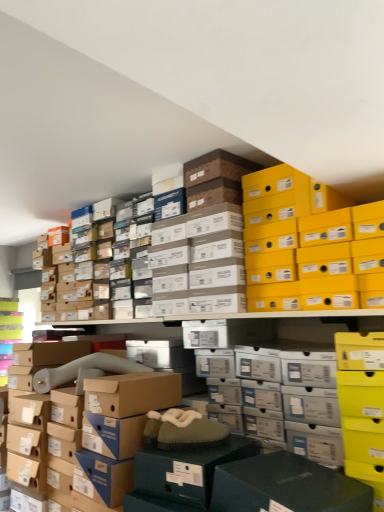
The image size is (384, 512). What do you see at coordinates (307, 251) in the screenshot? I see `yellow matte shoebox at upper right, which ranks as the second storage box in bottom-to-top order` at bounding box center [307, 251].

How much space does yellow matte shoebox at upper right, the first storage box in the right-to-left sequence, occupy horizontally?

yellow matte shoebox at upper right, the first storage box in the right-to-left sequence, is 12.72 inches in width.

At what (x,y) coordinates should I click in order to perform the action: click on yellow matte shoebox at upper right, the first storage box in the right-to-left sequence. Please return your answer as a coordinate pair (x, y). Looking at the image, I should click on (307, 251).

At what (x,y) coordinates should I click in order to perform the action: click on brown cardboard box at center, the first storage box in the left-to-right sequence. Please return your answer as a coordinate pair (x, y). The image size is (384, 512). Looking at the image, I should click on (115, 390).

This screenshot has height=512, width=384. Describe the element at coordinates (115, 390) in the screenshot. I see `brown cardboard box at center, acting as the second storage box starting from the top` at that location.

Find the location of a particular element. The height and width of the screenshot is (512, 384). yellow matte shoebox at upper right, the second storage box viewed from the left is located at coordinates (307, 251).

Considering the positions of objects yellow matte shoebox at upper right, the second storage box viewed from the left, and brown cardboard box at center, positioned as the 2th storage box in right-to-left order, in the image provided, who is more to the right, yellow matte shoebox at upper right, the second storage box viewed from the left, or brown cardboard box at center, positioned as the 2th storage box in right-to-left order,?

yellow matte shoebox at upper right, the second storage box viewed from the left.

Which object is closer to the camera taking this photo, yellow matte shoebox at upper right, the second storage box viewed from the left, or brown cardboard box at center, positioned as the 2th storage box in right-to-left order?

yellow matte shoebox at upper right, the second storage box viewed from the left, is more forward.

Between point (303, 278) and point (145, 378), which one is positioned in front?

Point (303, 278)

From the image's perspective, is yellow matte shoebox at upper right, which appears as the 1th storage box when viewed from the top, below brown cardboard box at center, the first storage box in the left-to-right sequence?

Actually, yellow matte shoebox at upper right, which appears as the 1th storage box when viewed from the top, appears above brown cardboard box at center, the first storage box in the left-to-right sequence, in the image.

From a real-world perspective, is yellow matte shoebox at upper right, the second storage box viewed from the left, above or below brown cardboard box at center, positioned as the 2th storage box in right-to-left order?

yellow matte shoebox at upper right, the second storage box viewed from the left, is above brown cardboard box at center, positioned as the 2th storage box in right-to-left order.

Considering the sizes of objects yellow matte shoebox at upper right, the second storage box viewed from the left, and brown cardboard box at center, the first storage box in the left-to-right sequence, in the image provided, who is wider, yellow matte shoebox at upper right, the second storage box viewed from the left, or brown cardboard box at center, the first storage box in the left-to-right sequence,?

Wider between the two is brown cardboard box at center, the first storage box in the left-to-right sequence.

Who is shorter, yellow matte shoebox at upper right, the first storage box in the right-to-left sequence, or brown cardboard box at center, the first storage box in the left-to-right sequence?

With less height is yellow matte shoebox at upper right, the first storage box in the right-to-left sequence.

Considering the relative sizes of yellow matte shoebox at upper right, which ranks as the second storage box in bottom-to-top order, and brown cardboard box at center, positioned as the 2th storage box in right-to-left order, in the image provided, is yellow matte shoebox at upper right, which ranks as the second storage box in bottom-to-top order, bigger than brown cardboard box at center, positioned as the 2th storage box in right-to-left order,?

Yes.

Can we say yellow matte shoebox at upper right, which appears as the 1th storage box when viewed from the top, lies outside brown cardboard box at center, positioned as the 2th storage box in right-to-left order?

yellow matte shoebox at upper right, which appears as the 1th storage box when viewed from the top, is positioned outside brown cardboard box at center, positioned as the 2th storage box in right-to-left order.

Is yellow matte shoebox at upper right, which appears as the 1th storage box when viewed from the top, far away from brown cardboard box at center, positioned as the 2th storage box in right-to-left order?

No, there isn't a large distance between yellow matte shoebox at upper right, which appears as the 1th storage box when viewed from the top, and brown cardboard box at center, positioned as the 2th storage box in right-to-left order.

Is yellow matte shoebox at upper right, which ranks as the second storage box in bottom-to-top order, turned away from brown cardboard box at center, positioned as the 2th storage box in right-to-left order?

yellow matte shoebox at upper right, which ranks as the second storage box in bottom-to-top order, does not have its back to brown cardboard box at center, positioned as the 2th storage box in right-to-left order.

Based on the photo, what's the angular difference between yellow matte shoebox at upper right, which appears as the 1th storage box when viewed from the top, and brown cardboard box at center, which appears as the first storage box when ordered from the bottom,'s facing directions?

They differ by 1.59 degrees in their facing directions.

You are a GUI agent. You are given a task and a screenshot of the screen. Output one action in this format:
    pyautogui.click(x=<x>, y=<y>)
    Task: Click on the storage box located above the brown cardboard box at center, acting as the second storage box starting from the top (from a real-world perspective)
    
    Given the screenshot: What is the action you would take?
    pyautogui.click(x=307, y=251)

Which object is positioned more to the left, brown cardboard box at center, positioned as the 2th storage box in right-to-left order, or yellow matte shoebox at upper right, the first storage box in the right-to-left sequence?

brown cardboard box at center, positioned as the 2th storage box in right-to-left order.

Is brown cardboard box at center, which appears as the first storage box when ordered from the bottom, positioned behind yellow matte shoebox at upper right, the first storage box in the right-to-left sequence?

That is True.

Does point (102, 362) come in front of point (277, 286)?

No, it is behind (277, 286).

From the image's perspective, does brown cardboard box at center, acting as the second storage box starting from the top, appear lower than yellow matte shoebox at upper right, the second storage box viewed from the left?

Yes, from the image's perspective, brown cardboard box at center, acting as the second storage box starting from the top, is beneath yellow matte shoebox at upper right, the second storage box viewed from the left.

From a real-world perspective, is brown cardboard box at center, positioned as the 2th storage box in right-to-left order, beneath yellow matte shoebox at upper right, which ranks as the second storage box in bottom-to-top order?

Yes, from a real-world perspective, brown cardboard box at center, positioned as the 2th storage box in right-to-left order, is beneath yellow matte shoebox at upper right, which ranks as the second storage box in bottom-to-top order.

Is brown cardboard box at center, positioned as the 2th storage box in right-to-left order, wider or thinner than yellow matte shoebox at upper right, which appears as the 1th storage box when viewed from the top?

Considering their sizes, brown cardboard box at center, positioned as the 2th storage box in right-to-left order, looks broader than yellow matte shoebox at upper right, which appears as the 1th storage box when viewed from the top.

Consider the image. Considering the sizes of objects brown cardboard box at center, which appears as the first storage box when ordered from the bottom, and yellow matte shoebox at upper right, the first storage box in the right-to-left sequence, in the image provided, who is taller, brown cardboard box at center, which appears as the first storage box when ordered from the bottom, or yellow matte shoebox at upper right, the first storage box in the right-to-left sequence,?

brown cardboard box at center, which appears as the first storage box when ordered from the bottom, is taller.

Is brown cardboard box at center, positioned as the 2th storage box in right-to-left order, smaller than yellow matte shoebox at upper right, the first storage box in the right-to-left sequence?

Yes.

Is brown cardboard box at center, the first storage box in the left-to-right sequence, spatially inside yellow matte shoebox at upper right, which ranks as the second storage box in bottom-to-top order, or outside of it?

brown cardboard box at center, the first storage box in the left-to-right sequence, is spatially situated outside yellow matte shoebox at upper right, which ranks as the second storage box in bottom-to-top order.

Is brown cardboard box at center, acting as the second storage box starting from the top, not close to yellow matte shoebox at upper right, the first storage box in the right-to-left sequence?

brown cardboard box at center, acting as the second storage box starting from the top, is actually quite close to yellow matte shoebox at upper right, the first storage box in the right-to-left sequence.

Could you tell me if brown cardboard box at center, the first storage box in the left-to-right sequence, is facing yellow matte shoebox at upper right, which appears as the 1th storage box when viewed from the top?

No, brown cardboard box at center, the first storage box in the left-to-right sequence, is not oriented towards yellow matte shoebox at upper right, which appears as the 1th storage box when viewed from the top.

How different are the orientations of brown cardboard box at center, acting as the second storage box starting from the top, and yellow matte shoebox at upper right, the first storage box in the right-to-left sequence, in degrees?

The angular difference between brown cardboard box at center, acting as the second storage box starting from the top, and yellow matte shoebox at upper right, the first storage box in the right-to-left sequence, is 1.59 degrees.

Identify the location of storage box above the brown cardboard box at center, acting as the second storage box starting from the top (from a real-world perspective). (307, 251).

Find the location of `storage box located in front of the brown cardboard box at center, which appears as the first storage box when ordered from the bottom`. storage box located in front of the brown cardboard box at center, which appears as the first storage box when ordered from the bottom is located at coordinates (307, 251).

At what (x,y) coordinates should I click in order to perform the action: click on storage box located underneath the yellow matte shoebox at upper right, the first storage box in the right-to-left sequence (from a real-world perspective). Please return your answer as a coordinate pair (x, y). This screenshot has width=384, height=512. Looking at the image, I should click on (115, 390).